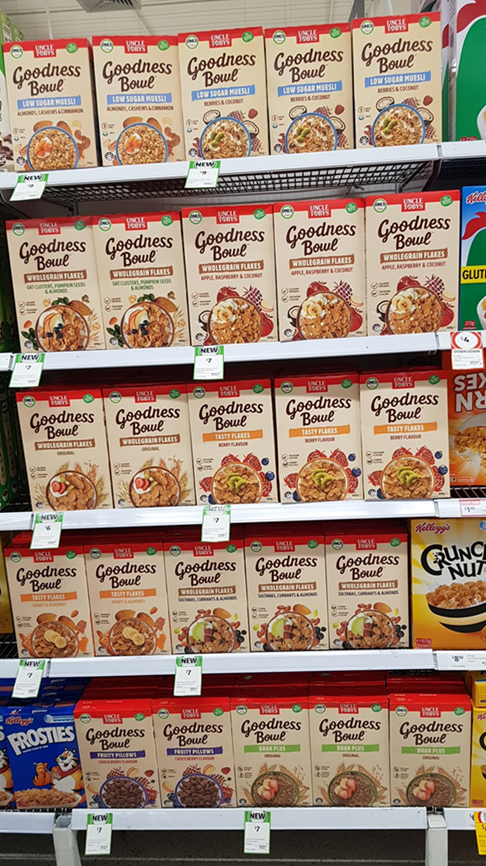
What are the coordinates of `cereal box on top shelf` in the screenshot? It's located at (474, 44), (446, 48), (387, 66), (308, 87), (232, 92), (134, 100), (66, 105), (7, 27), (19, 34).